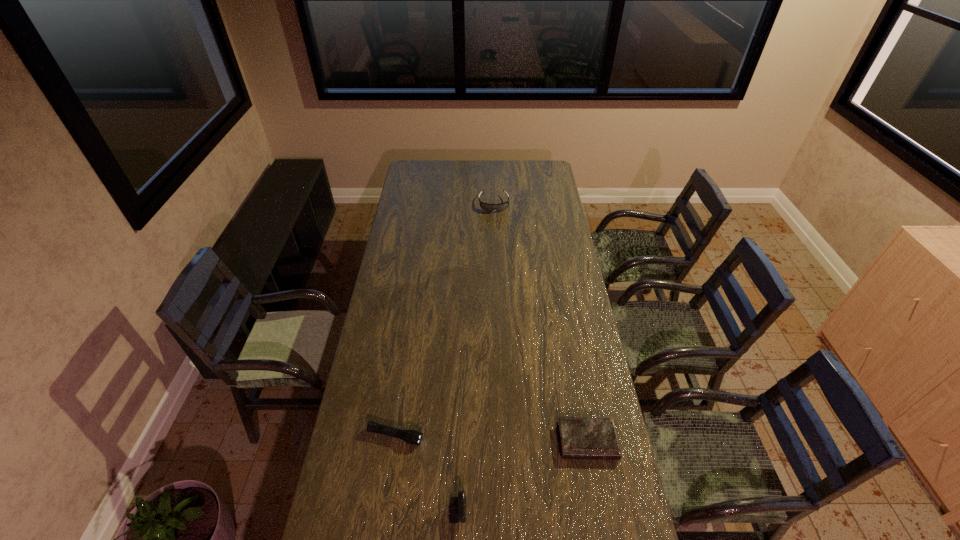
The image size is (960, 540). I want to click on vacant area at the left edge, so click(x=360, y=497).

The width and height of the screenshot is (960, 540). In the image, there is a desktop. Find the location of `blank space at the right edge`. blank space at the right edge is located at coordinates (562, 260).

Identify the location of free space at the far left corner of the desktop. (423, 164).

Locate an element on the screen. Image resolution: width=960 pixels, height=540 pixels. free space at the far right corner of the desktop is located at coordinates (535, 166).

At what (x,y) coordinates should I click in order to perform the action: click on free space between the flashlight and the nearest object. Please return your answer as a coordinate pair (x, y). This screenshot has width=960, height=540. Looking at the image, I should click on (410, 476).

You are a GUI agent. You are given a task and a screenshot of the screen. Output one action in this format:
    pyautogui.click(x=<x>, y=<y>)
    Task: Click on the free space that is in between the goggles and the flashlight
    
    Given the screenshot: What is the action you would take?
    pos(444,320)

Find the location of `empty space that is in between the flashlight and the diary`. empty space that is in between the flashlight and the diary is located at coordinates (492, 438).

You are a GUI agent. You are given a task and a screenshot of the screen. Output one action in this format:
    pyautogui.click(x=<x>, y=<y>)
    Task: Click on the free space between the flashlight and the rightmost object
    The width and height of the screenshot is (960, 540).
    Given the screenshot: What is the action you would take?
    pyautogui.click(x=492, y=438)

Find the location of a particular element. The height and width of the screenshot is (540, 960). unoccupied area between the goggles and the nearest object is located at coordinates (459, 360).

Locate an element on the screen. vacant space that's between the flashlight and the webcam is located at coordinates (410, 476).